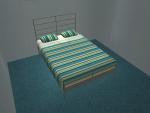
At what (x,y) coordinates should I click in order to perform the action: click on foot of bed. Please return your answer as a coordinate pair (x, y). This screenshot has height=113, width=150. Looking at the image, I should click on (90, 78).